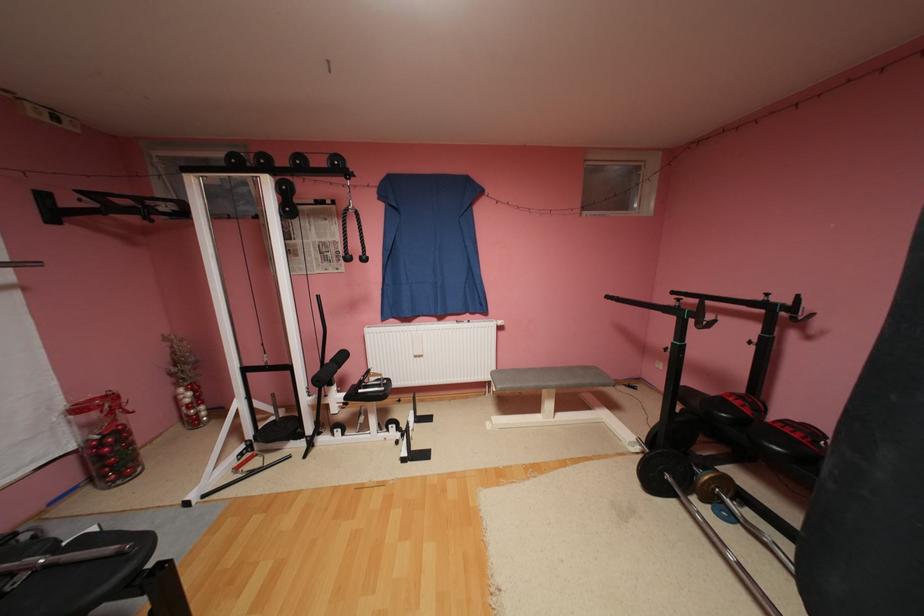
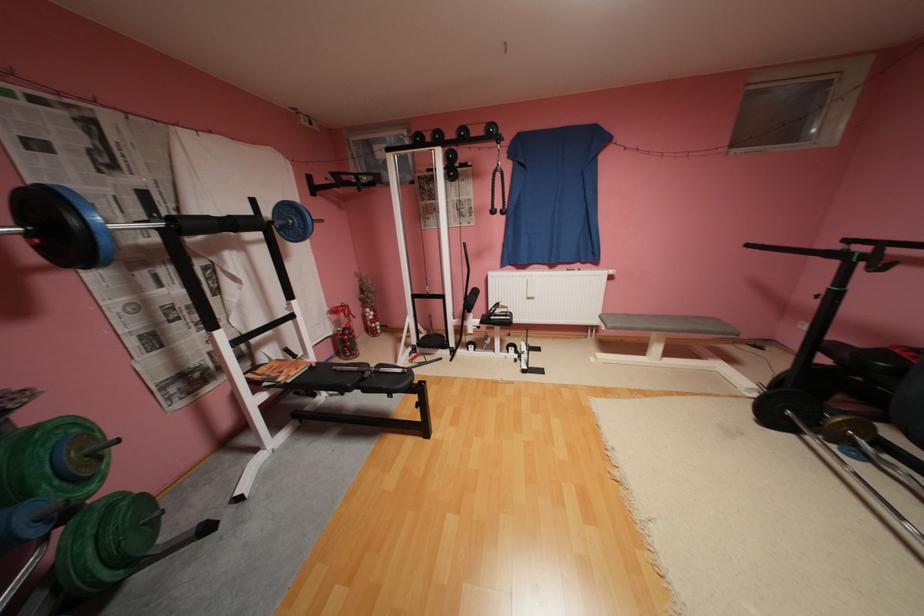
Find the pixel in the second image that matches [357,257] in the first image.

(502, 212)